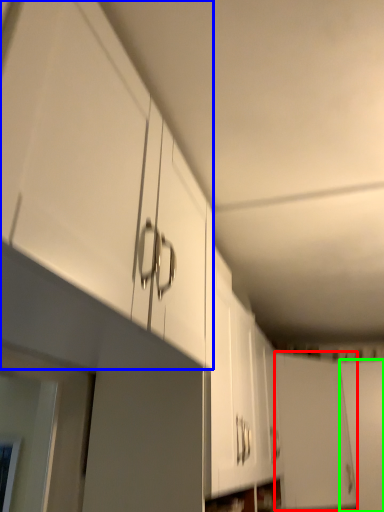
Question: Which object is the closest to the door (highlighted by a red box)? Choose among these: cabinetry (highlighted by a blue box) or door (highlighted by a green box).

Choices:
 (A) cabinetry
 (B) door

Answer: (B)